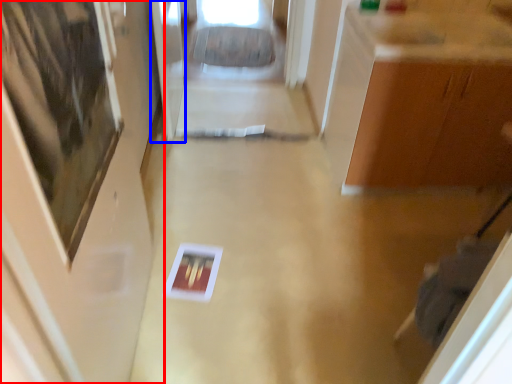
Question: Which object appears closest to the camera in this image, door (highlighted by a red box) or glass door (highlighted by a blue box)?

Choices:
 (A) door
 (B) glass door

Answer: (A)